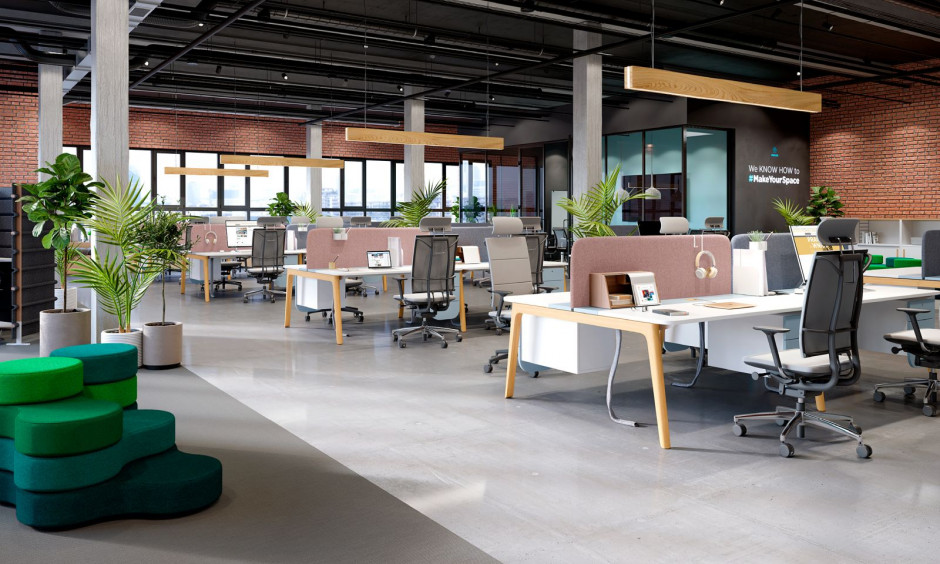
Where is `glass office panes`? The width and height of the screenshot is (940, 564). glass office panes is located at coordinates (472, 206), (503, 207), (538, 205), (562, 186), (600, 171), (619, 165), (666, 170), (705, 182).